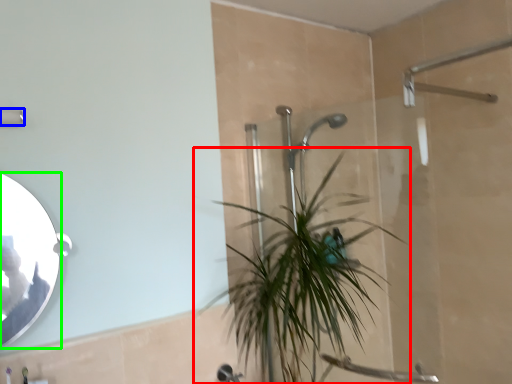
Question: Estimate the real-world distances between objects in this image. Which object is closer to houseplant (highlighted by a red box), shower (highlighted by a blue box) or mirror (highlighted by a green box)?

Choices:
 (A) shower
 (B) mirror

Answer: (B)